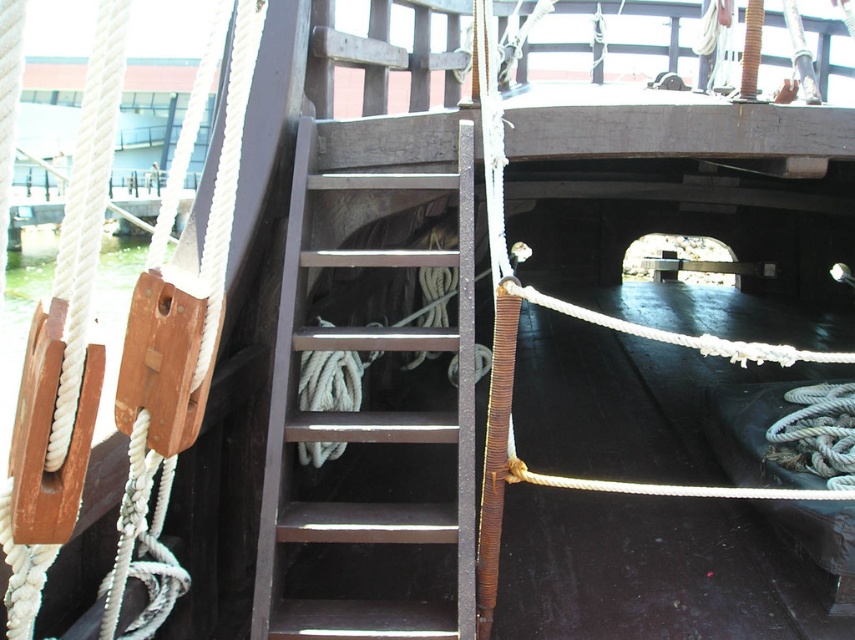
Can you confirm if white rope at lower right is positioned below white rope at center?

Yes.

Does white rope at lower right come behind white rope at center?

Yes, it is.

Identify the location of white rope at lower right. The width and height of the screenshot is (855, 640). (817, 433).

Which of these two, rustic wood stairs at center or white rope at lower right, stands shorter?

Standing shorter between the two is white rope at lower right.

The width and height of the screenshot is (855, 640). In order to click on rustic wood stairs at center in this screenshot , I will do `click(366, 413)`.

Locate an element on the screen. rustic wood stairs at center is located at coordinates (366, 413).

Is rustic wood stairs at center further to camera compared to white rope at center?

Yes.

Does rustic wood stairs at center appear under white rope at center?

Indeed, rustic wood stairs at center is positioned under white rope at center.

Does point (317, 182) lie behind point (812, 353)?

Yes, it is.

The width and height of the screenshot is (855, 640). What are the coordinates of `rustic wood stairs at center` in the screenshot? It's located at (366, 413).